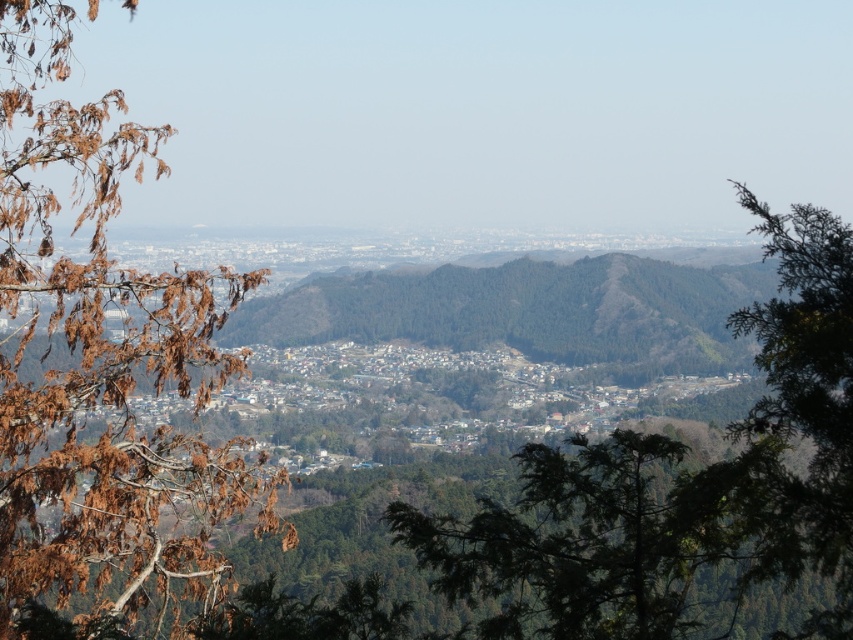
Which is above, green leafy tree at center or green leafy tree at right?

green leafy tree at right

Does green leafy tree at center appear under green leafy tree at right?

Yes, green leafy tree at center is below green leafy tree at right.

Is point (827, 620) closer to viewer compared to point (682, 509)?

No, (827, 620) is behind (682, 509).

Where is `green leafy tree at center`? The height and width of the screenshot is (640, 853). green leafy tree at center is located at coordinates (637, 540).

Can you confirm if brown dried leaves at left is positioned below green leafy tree at right?

No.

Is brown dried leaves at left closer to camera compared to green leafy tree at right?

No, brown dried leaves at left is behind green leafy tree at right.

Is point (64, 58) closer to viewer compared to point (830, 326)?

No, it is behind (830, 326).

The width and height of the screenshot is (853, 640). Identify the location of brown dried leaves at left. (102, 369).

Is brown dried leaves at left above green leafy tree at center?

Correct, brown dried leaves at left is located above green leafy tree at center.

Who is more forward, (44, 260) or (497, 618)?

Positioned in front is point (497, 618).

Does point (158, 508) lie in front of point (634, 595)?

No, it is not.

Where is `brown dried leaves at left`? The height and width of the screenshot is (640, 853). brown dried leaves at left is located at coordinates (102, 369).